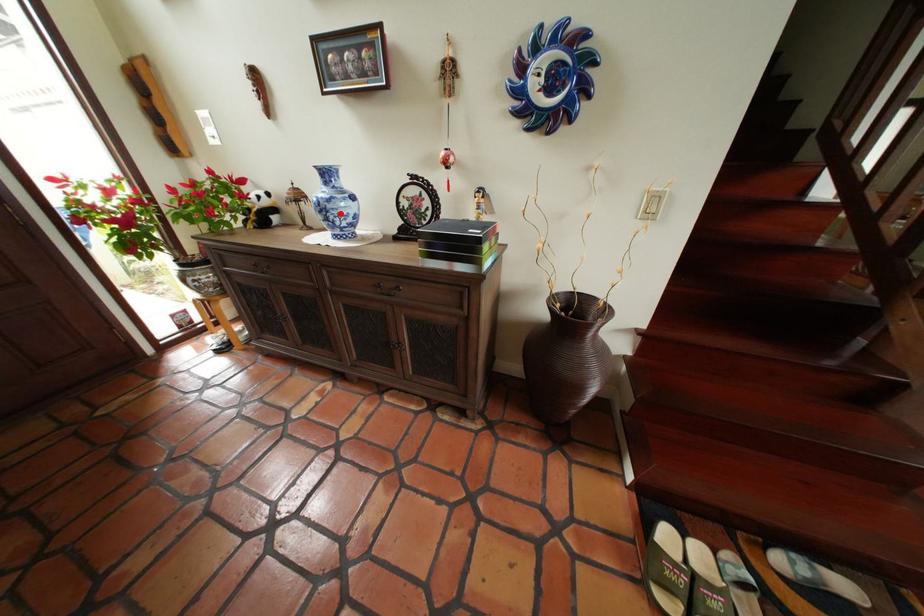
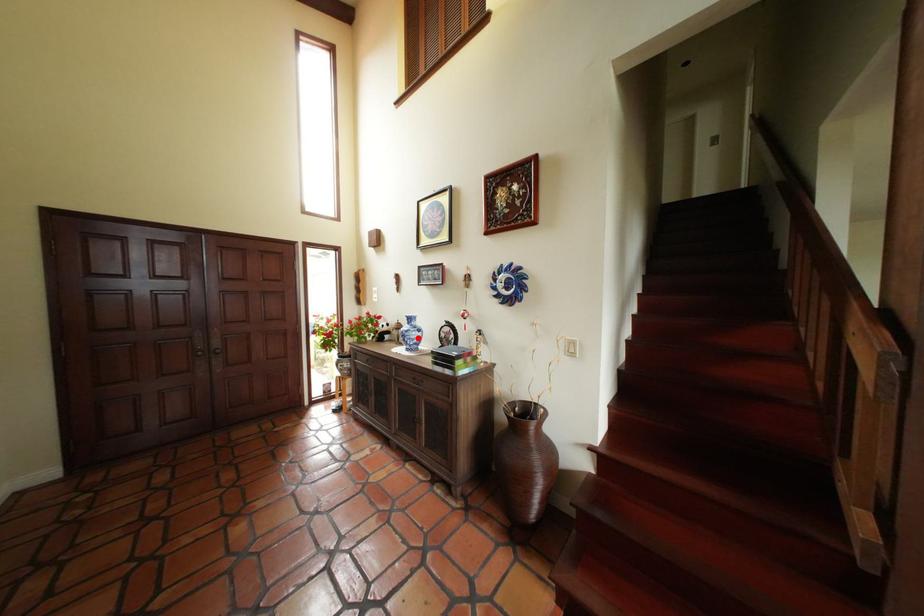
From the picture: I am providing you with two images of the same scene from different viewpoints. A red point is marked on the first image and another point is marked on the second image. Is the marked point in image1 the same physical position as the marked point in image2?

Yes